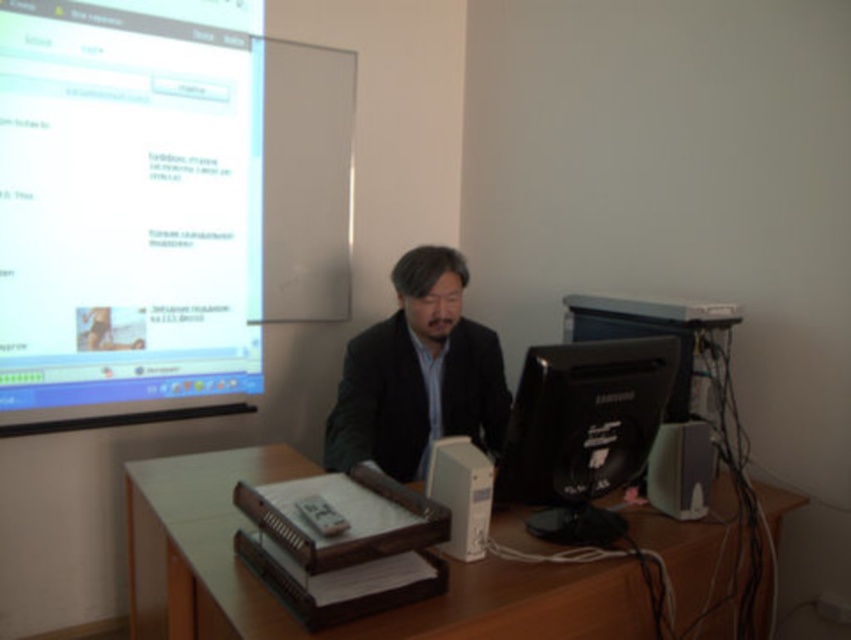
Does matte white projector screen at upper left appear over brown wooden table at center?

Indeed, matte white projector screen at upper left is positioned over brown wooden table at center.

Between point (233, 96) and point (447, 625), which one is positioned behind?

The point (233, 96) is more distant.

Is point (250, 12) positioned behind point (512, 577)?

Yes.

Find the location of a particular element. The width and height of the screenshot is (851, 640). matte white projector screen at upper left is located at coordinates (124, 204).

Between black matte suit at center and black glossy monitor at center, which one appears on the left side from the viewer's perspective?

black matte suit at center

Can you confirm if black matte suit at center is positioned below black glossy monitor at center?

Actually, black matte suit at center is above black glossy monitor at center.

Measure the distance between point (363, 371) and camera.

They are 7.03 feet apart.

Find the location of a particular element. The width and height of the screenshot is (851, 640). black matte suit at center is located at coordinates (418, 374).

Is matte white projector screen at upper left closer to camera compared to black matte suit at center?

No, it is not.

Does matte white projector screen at upper left have a lesser height compared to black matte suit at center?

No, matte white projector screen at upper left is not shorter than black matte suit at center.

Is point (54, 74) closer to camera compared to point (447, 374)?

No.

You are a GUI agent. You are given a task and a screenshot of the screen. Output one action in this format:
    pyautogui.click(x=<x>, y=<y>)
    Task: Click on the matte white projector screen at upper left
    The height and width of the screenshot is (640, 851).
    Given the screenshot: What is the action you would take?
    pyautogui.click(x=124, y=204)